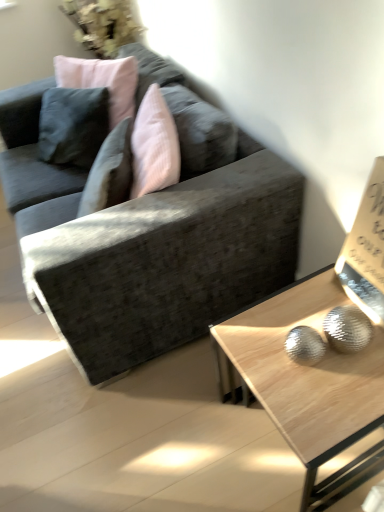
This screenshot has height=512, width=384. Find the location of `vacant space situated above light wood/texture coffee table at lower right (from a real-world perspective)`. vacant space situated above light wood/texture coffee table at lower right (from a real-world perspective) is located at coordinates (302, 364).